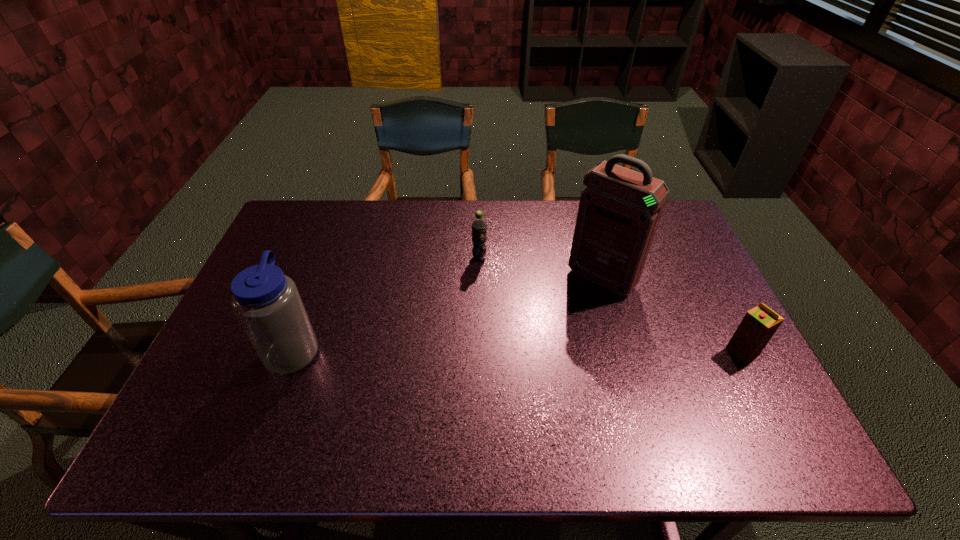
Where is `the leftmost object`? The height and width of the screenshot is (540, 960). the leftmost object is located at coordinates (266, 302).

Find the location of `the third shortest object`. the third shortest object is located at coordinates (266, 302).

Identify the location of orange juice. (759, 324).

You are a GUI agent. You are given a task and a screenshot of the screen. Output one action in this format:
    pyautogui.click(x=<x>, y=<y>)
    Task: Click on the third object from right to left
    
    Given the screenshot: What is the action you would take?
    pyautogui.click(x=479, y=226)

You are a GUI agent. You are given a task and a screenshot of the screen. Output one action in this format:
    pyautogui.click(x=<x>, y=<y>)
    Task: Click on the tallest object
    Image resolution: width=960 pixels, height=540 pixels.
    Given the screenshot: What is the action you would take?
    pyautogui.click(x=619, y=211)

This screenshot has width=960, height=540. I want to click on the first-aid kit, so click(x=619, y=211).

Where is `blank space located 0.240m with a carrying loop on the side of the water bottle`? The height and width of the screenshot is (540, 960). blank space located 0.240m with a carrying loop on the side of the water bottle is located at coordinates (416, 348).

You are a GUI agent. You are given a task and a screenshot of the screen. Output one action in this format:
    pyautogui.click(x=<x>, y=<y>)
    Task: Click on the free space located on the left of the orange juice
    The image size is (960, 540).
    Given the screenshot: What is the action you would take?
    pyautogui.click(x=571, y=352)

Where is `vacant space located 0.350m on the front label of the third object from right to left`? Image resolution: width=960 pixels, height=540 pixels. vacant space located 0.350m on the front label of the third object from right to left is located at coordinates (492, 356).

Locate an element on the screen. free space located 0.070m on the front label of the third object from right to left is located at coordinates (482, 279).